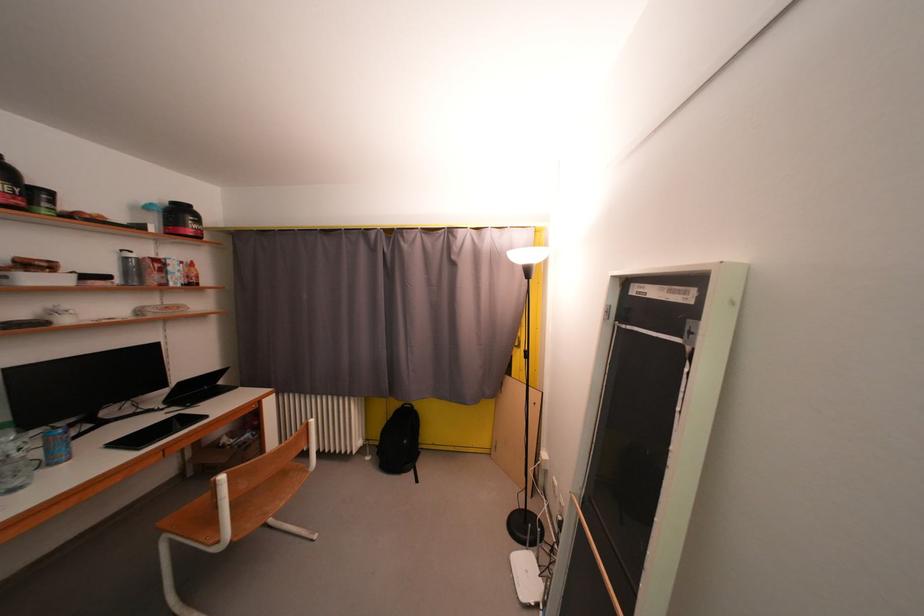
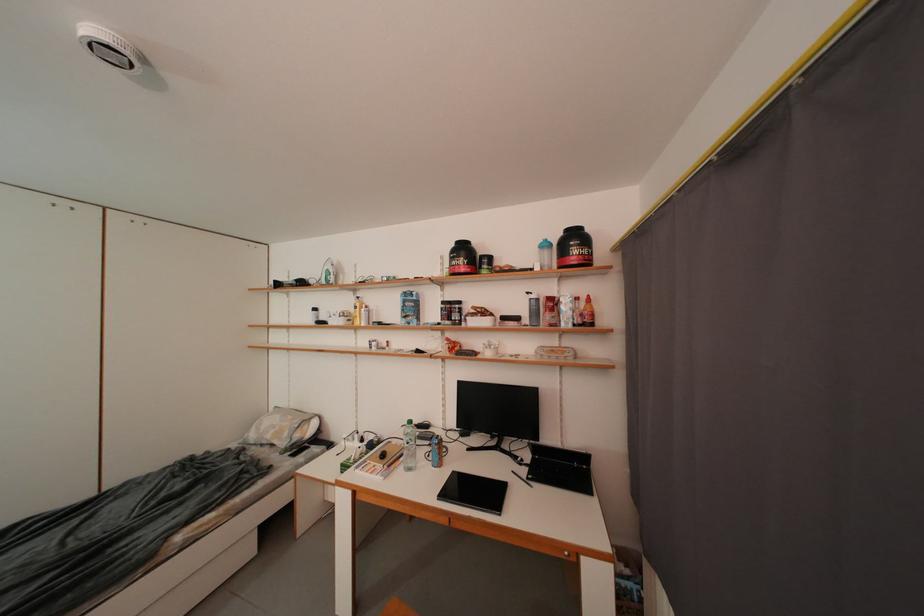
Locate, in the second image, the point that corresponds to (126,284) in the first image.

(533, 323)